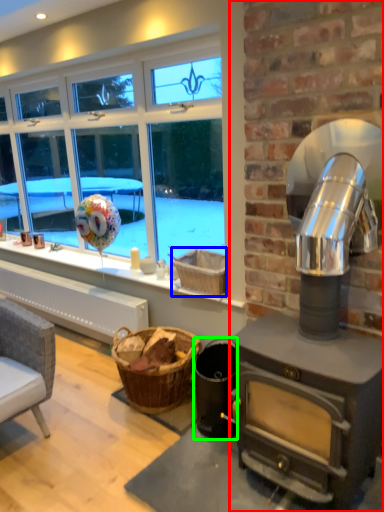
Question: Which is farther away from fireplace (highlighted by a red box)? basket (highlighted by a blue box) or appliance (highlighted by a green box)?

Choices:
 (A) basket
 (B) appliance

Answer: (B)